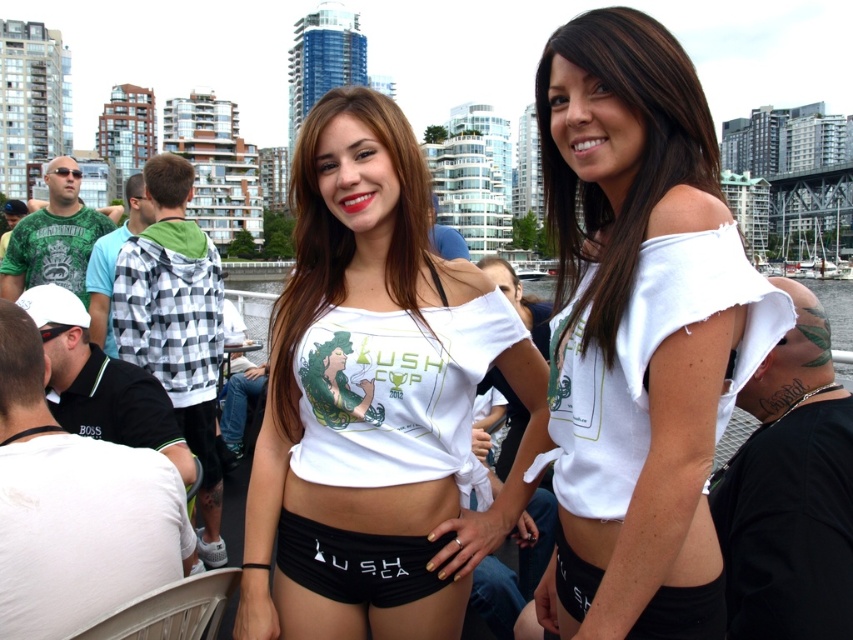
Is white frayed shirt at center behind black matte shorts at center?

No, white frayed shirt at center is closer to the viewer.

Is point (577, 474) behind point (328, 570)?

That is False.

Where is `white frayed shirt at center`? white frayed shirt at center is located at coordinates (639, 330).

Does point (384, 348) lie in front of point (306, 544)?

No.

Consider the image. Is white matte bikini top at center bigger than black matte shorts at center?

Yes.

I want to click on white matte bikini top at center, so click(x=395, y=392).

Looking at this image, which is below, white frayed shirt at center or white matte crop top at center?

Positioned lower is white matte crop top at center.

Does white frayed shirt at center have a greater height compared to white matte crop top at center?

Correct, white frayed shirt at center is much taller as white matte crop top at center.

Locate an element on the screen. This screenshot has height=640, width=853. white frayed shirt at center is located at coordinates (639, 330).

Find the location of `white frayed shirt at center`. white frayed shirt at center is located at coordinates (639, 330).